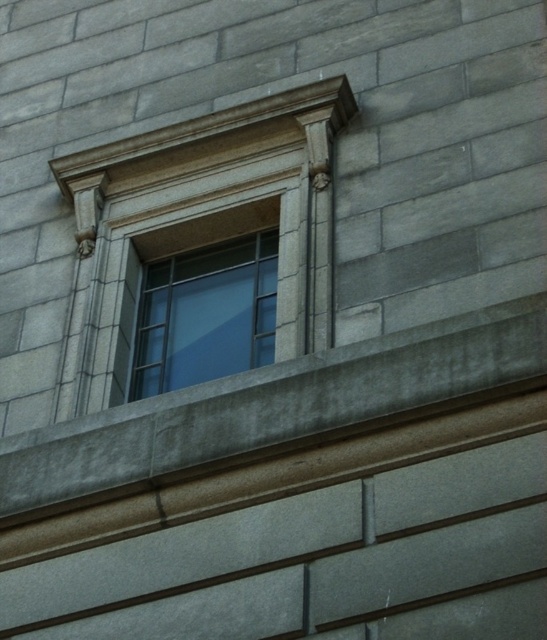
Question: Which of the following is the farthest from the observer?

Choices:
 (A) clear glass window at center
 (B) gray stone ledge at center

Answer: (A)

Question: Is gray stone ledge at center closer to camera compared to clear glass window at center?

Choices:
 (A) no
 (B) yes

Answer: (B)

Question: Is gray stone ledge at center thinner than clear glass window at center?

Choices:
 (A) no
 (B) yes

Answer: (B)

Question: Is gray stone ledge at center smaller than clear glass window at center?

Choices:
 (A) yes
 (B) no

Answer: (A)